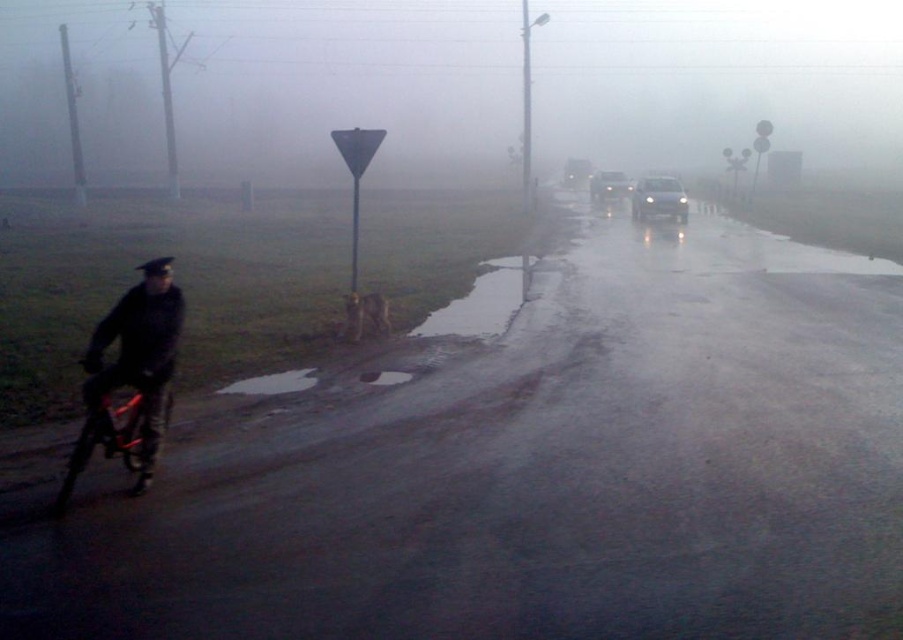
You are a pedestrian walking on the road and see the matte black jacket at left and the glossy concrete puddle at lower center. Which object is nearer to you?

The matte black jacket at left is closer to the viewer than the glossy concrete puddle at lower center.

You are driving a car and see two points on the road ahead. The first point is at coordinate point(x=145, y=401) and the second is at point(x=106, y=456). Which point is closer to your car?

Point(x=145, y=401) is in front of point(x=106, y=456), so it is closer to your car.

You are a delivery driver who needs to locate the matte black jacket at left in the scene. Based on the coordinates provided, where should you look relative to the center of the image?

The matte black jacket at left is located at coordinates approximately 55.3 percent from the left edge and 15.5 percent from the top edge of the image.